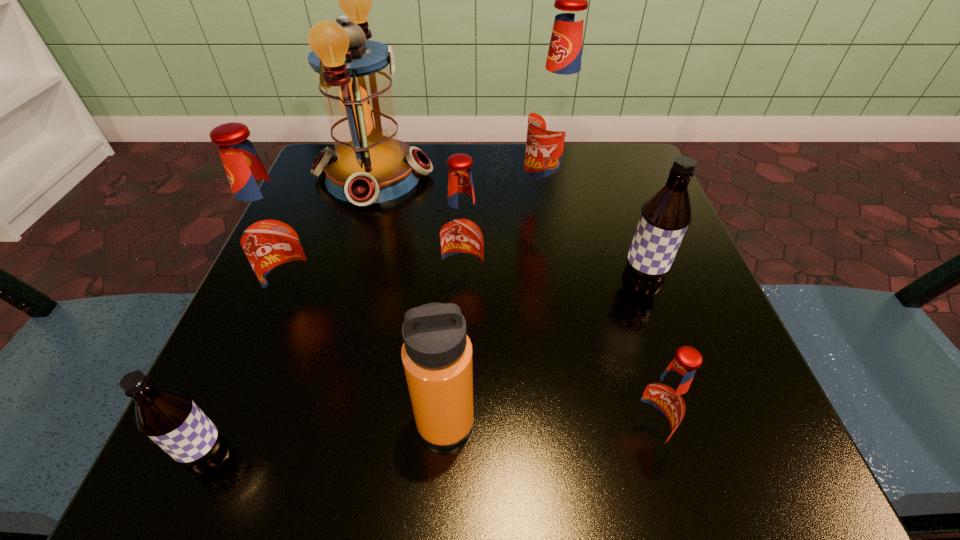
Image resolution: width=960 pixels, height=540 pixels. Find the location of `free space between the biggest red root beer and the nearer brown root beer`. free space between the biggest red root beer and the nearer brown root beer is located at coordinates (380, 330).

The image size is (960, 540). Identify the location of object that can be found as the fifth closest to the bigger brown root beer. (369, 164).

Locate an element on the screen. Image resolution: width=960 pixels, height=540 pixels. object that is the fourth closest one to the smallest red root beer is located at coordinates (556, 120).

Find the location of a particular element. This screenshot has height=540, width=960. root beer that is the third closest to the third red root beer from right to left is located at coordinates (665, 216).

Where is `root beer that is the closest to the smallest red root beer`? root beer that is the closest to the smallest red root beer is located at coordinates (665, 216).

This screenshot has height=540, width=960. What are the coordinates of `the third closest red root beer to the farthest red root beer` in the screenshot? It's located at (662, 404).

Choose which red root beer is the nearest neighbor to the farthest root beer. Please provide its 2D coordinates. Your answer should be formatted as a tuple, i.e. [(x, y)], where the tuple contains the x and y coordinates of a point satisfying the conditions above.

[(462, 235)]

Locate an element on the screen. vacant space that satisfies the following two spatial constraints: 1. on the front-facing side of the lantern; 2. on the back side of the nearest red root beer is located at coordinates (295, 438).

At what (x,y) coordinates should I click in order to perform the action: click on free spot that satisfies the following two spatial constraints: 1. on the front-facing side of the thermos bottle; 2. on the right side of the lantern. Please return your answer as a coordinate pair (x, y). The width and height of the screenshot is (960, 540). Looking at the image, I should click on (300, 422).

Where is `blank area in the image that satisfies the following two spatial constraints: 1. on the front side of the third smallest red root beer; 2. on the left side of the thermos bottle`? blank area in the image that satisfies the following two spatial constraints: 1. on the front side of the third smallest red root beer; 2. on the left side of the thermos bottle is located at coordinates (260, 422).